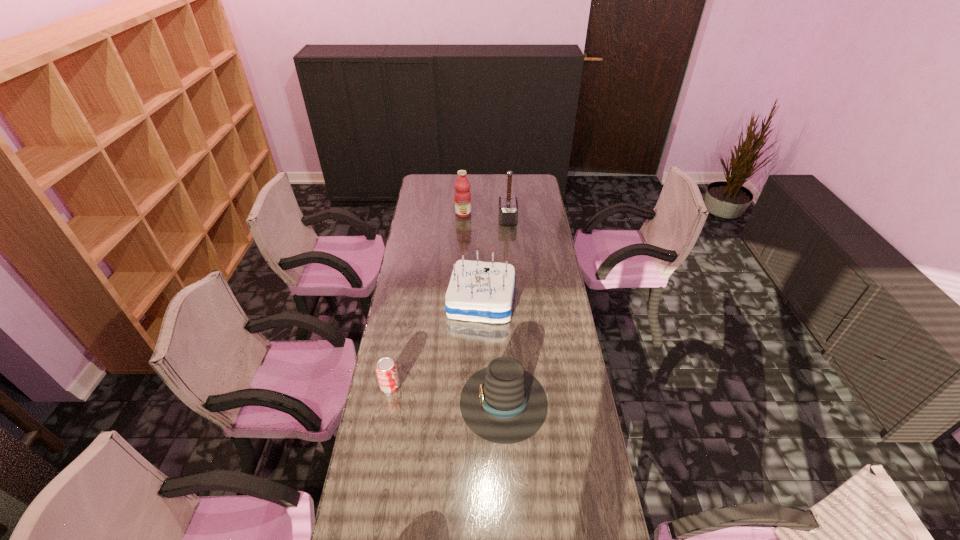
Where is `hammer`? The width and height of the screenshot is (960, 540). hammer is located at coordinates (508, 206).

This screenshot has width=960, height=540. What are the coordinates of `fruit juice` in the screenshot? It's located at (462, 194).

Identify the location of birthday cake. The image size is (960, 540). (478, 291).

In order to click on hat in this screenshot , I will do `click(502, 403)`.

At what (x,y) coordinates should I click in order to perform the action: click on the leftmost object. Please return your answer as a coordinate pair (x, y). The image size is (960, 540). Looking at the image, I should click on (386, 369).

This screenshot has height=540, width=960. I want to click on the shortest object, so click(x=386, y=369).

You are a GUI agent. You are given a task and a screenshot of the screen. Output one action in this format:
    pyautogui.click(x=<x>, y=<y>)
    Task: Click on the vacant space positioned 0.380m on the left of the hammer
    
    Given the screenshot: What is the action you would take?
    pyautogui.click(x=429, y=219)

I want to click on vacant area situated on the label of the fruit juice, so click(x=462, y=235).

At what (x,y) coordinates should I click in order to perform the action: click on vacant space located on the back of the third farthest object. Please return your answer as a coordinate pair (x, y). This screenshot has width=960, height=540. Looking at the image, I should click on (481, 235).

Find the location of a particular element. Image resolution: width=960 pixels, height=540 pixels. vacant region located 0.100m on the front-facing side of the fourth tallest object is located at coordinates (431, 401).